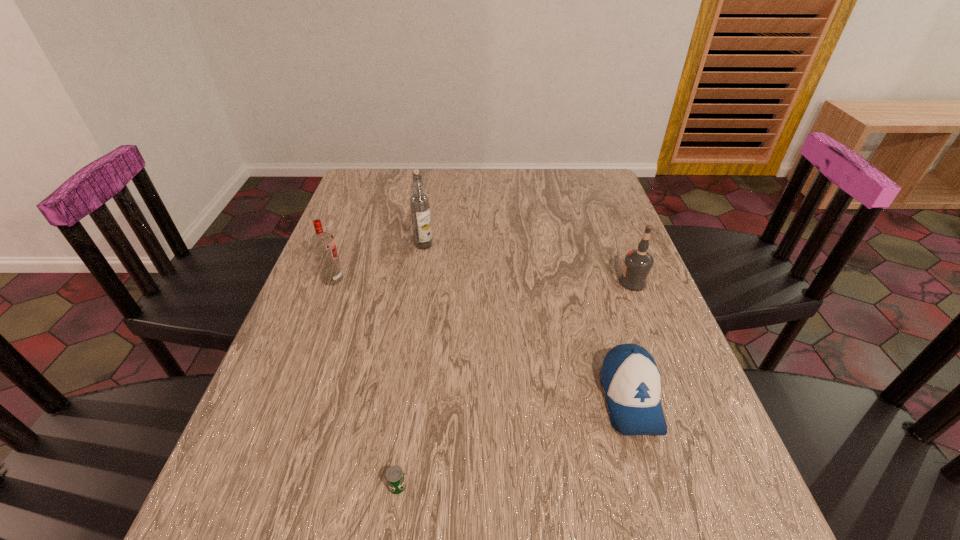
The width and height of the screenshot is (960, 540). I want to click on vacant space located 0.380m on the front label of the rightmost vodka, so pos(468,282).

Identify the location of free space located 0.380m on the front label of the rightmost vodka. (468, 282).

This screenshot has width=960, height=540. Find the location of `vacant space located on the front label of the rightmost vodka`. vacant space located on the front label of the rightmost vodka is located at coordinates (536, 282).

Image resolution: width=960 pixels, height=540 pixels. I want to click on free location located 0.150m on the front-facing side of the second object from right to left, so click(x=672, y=536).

Where is `vacant area located 0.240m on the back of the shortest object`? This screenshot has width=960, height=540. vacant area located 0.240m on the back of the shortest object is located at coordinates 417,346.

Find the location of a particular element. object that is at the near edge is located at coordinates (395, 478).

Where is `object that is at the left edge`? The image size is (960, 540). object that is at the left edge is located at coordinates (323, 245).

Locate an element on the screen. The width and height of the screenshot is (960, 540). vodka that is at the right edge is located at coordinates (638, 263).

I want to click on baseball cap positioned at the right edge, so click(631, 380).

Where is `free space at the far edge of the desktop`? Image resolution: width=960 pixels, height=540 pixels. free space at the far edge of the desktop is located at coordinates (431, 171).